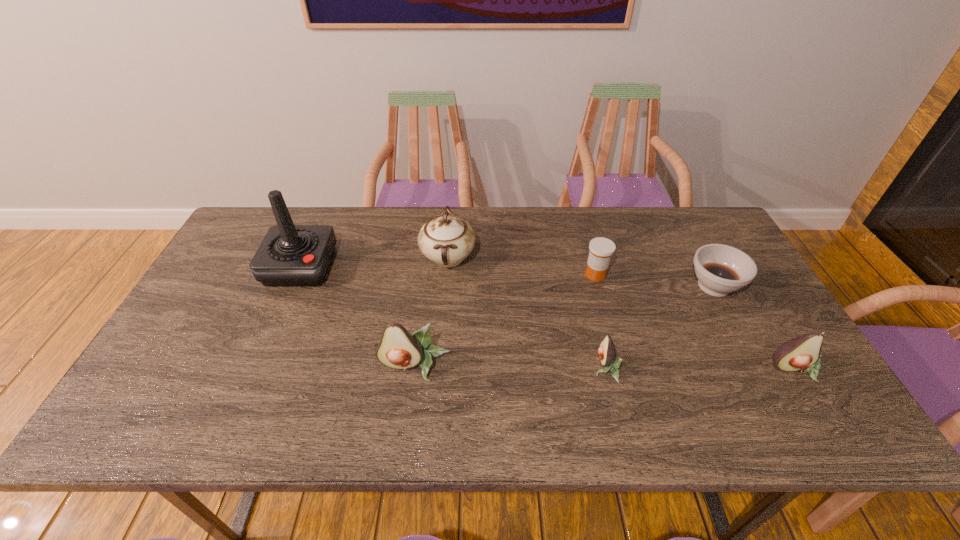
Where is `the leftmost avocado`? the leftmost avocado is located at coordinates (398, 349).

Find the location of a particular element. the shortest avocado is located at coordinates (607, 353).

Image resolution: width=960 pixels, height=540 pixels. Find the location of `the rightmost avocado`. the rightmost avocado is located at coordinates pyautogui.click(x=801, y=353).

I want to click on chinaware, so click(x=447, y=239).

Find the location of a particular element. medicine is located at coordinates pyautogui.click(x=601, y=249).

Where is `the tallest object`? Image resolution: width=960 pixels, height=540 pixels. the tallest object is located at coordinates (289, 255).

I want to click on joystick, so click(x=289, y=255).

Identify the location of soup bowl. The image size is (960, 540). tap(720, 269).

You are a GUI agent. You are given a task and a screenshot of the screen. Output one action in this format:
    pyautogui.click(x=<x>, y=<y>)
    Task: Click on the vacant space located 0.250m on the seed side of the second avocado from right to left
    
    Given the screenshot: What is the action you would take?
    pyautogui.click(x=492, y=368)

This screenshot has height=540, width=960. Identify the location of free location located on the seed side of the second avocado from right to left. (508, 368).